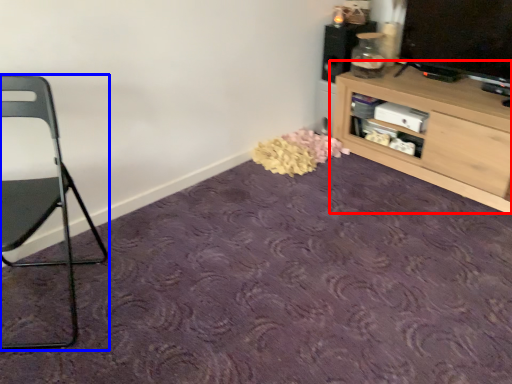
Question: Which of the following is the farthest to the observer, shelf (highlighted by a red box) or chair (highlighted by a blue box)?

Choices:
 (A) shelf
 (B) chair

Answer: (A)